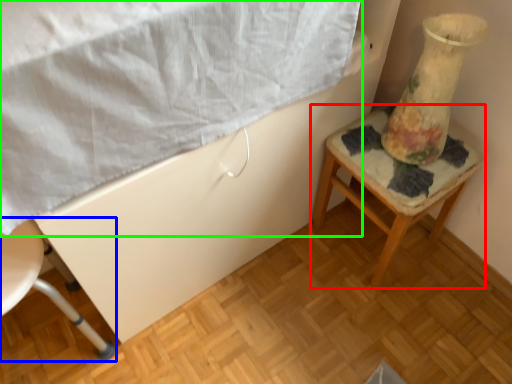
Question: Estimate the real-world distances between objects in this image. Which object is farther from furniture (highlighted by a red box), chair (highlighted by a blue box) or sheet (highlighted by a green box)?

Choices:
 (A) chair
 (B) sheet

Answer: (A)